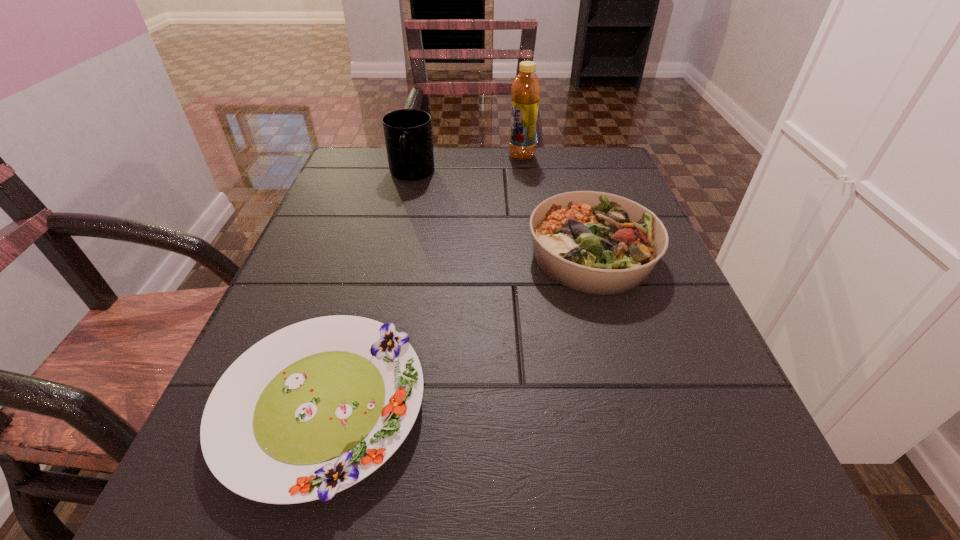
Locate an element on the screen. free location at the right edge of the desktop is located at coordinates (608, 362).

Find the location of `free space at the far left corner of the desktop`. free space at the far left corner of the desktop is located at coordinates (370, 170).

The height and width of the screenshot is (540, 960). I want to click on blank space at the far right corner of the desktop, so click(x=613, y=173).

Where is `free space between the second nearest object and the nearest object`? free space between the second nearest object and the nearest object is located at coordinates (457, 330).

Locate an element on the screen. Image resolution: width=960 pixels, height=540 pixels. blank region between the tallest object and the shorter salad plate is located at coordinates (422, 281).

You are a GUI agent. You are given a task and a screenshot of the screen. Output one action in this format:
    pyautogui.click(x=<x>, y=<y>)
    Task: Click on the vacant space in between the second tallest object and the nearer salad plate
    
    Given the screenshot: What is the action you would take?
    pyautogui.click(x=367, y=290)

This screenshot has height=540, width=960. What are the coordinates of `unoccupied area between the farther salad plate and the shorter salad plate` in the screenshot? It's located at (457, 330).

Find the location of a particular element. The height and width of the screenshot is (540, 960). vacant point located between the second tallest object and the left salad plate is located at coordinates (367, 290).

Find the location of a particular element. This screenshot has width=960, height=540. free spot between the mug and the bottle is located at coordinates (467, 165).

Where is `unoccupied area between the mug and the tallest object`? This screenshot has width=960, height=540. unoccupied area between the mug and the tallest object is located at coordinates (467, 165).